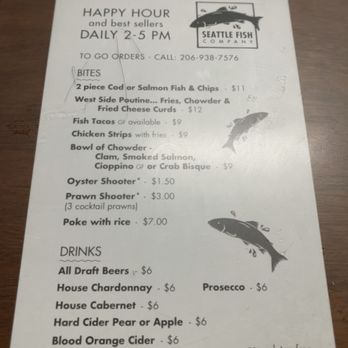
Identify the location of black wood table, background. Image resolution: width=348 pixels, height=348 pixels. (18, 145).